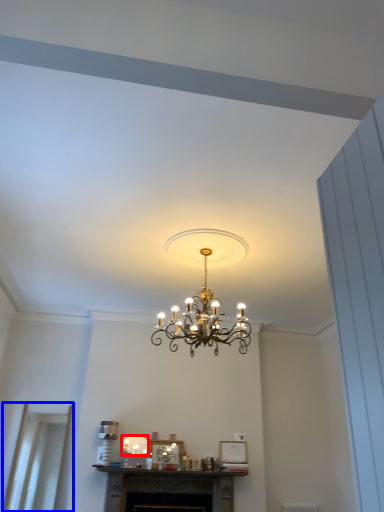
Question: Which point is further to the camera, lamp (highlighted by a red box) or glass door (highlighted by a blue box)?

Choices:
 (A) lamp
 (B) glass door

Answer: (A)